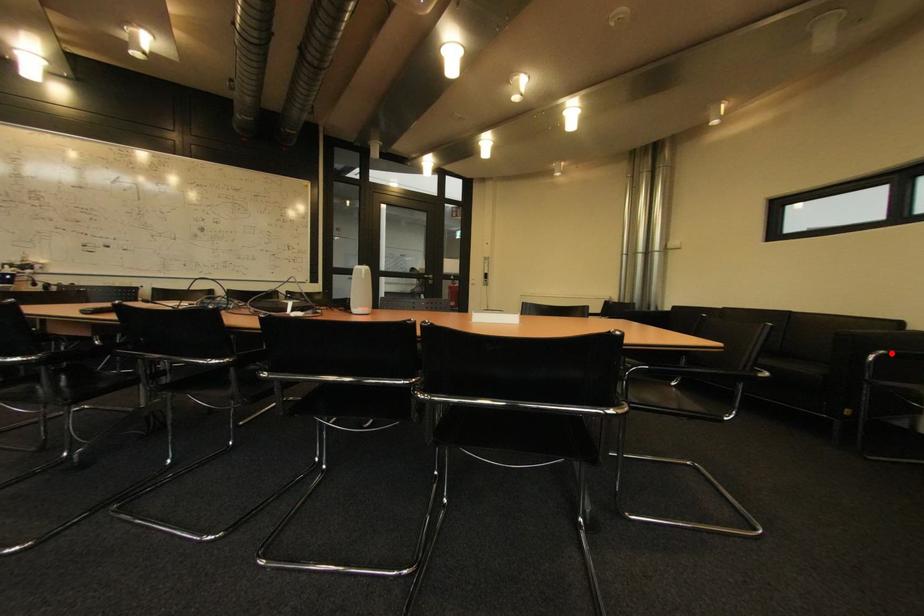
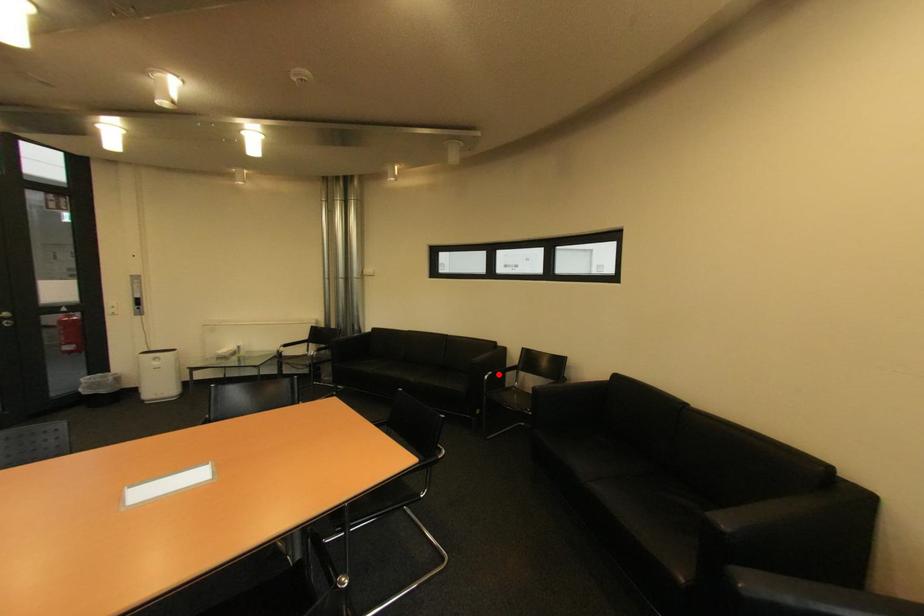
I am providing you with two images of the same scene from different viewpoints. A red point is marked on the first image and another point is marked on the second image. Are the points marked in image1 and image2 representing the same 3D position?

Yes